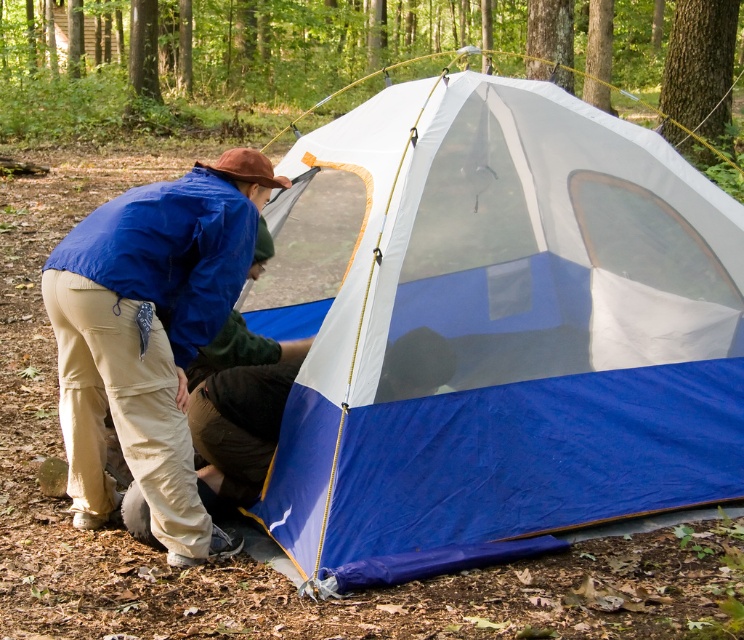
Question: Does blue tarpaulin tent at center have a larger size compared to blue fabric jacket at lower left?

Choices:
 (A) no
 (B) yes

Answer: (B)

Question: Does blue tarpaulin tent at center appear over blue fabric jacket at lower left?

Choices:
 (A) no
 (B) yes

Answer: (B)

Question: Which point appears farthest from the camera in this image?

Choices:
 (A) (164, 314)
 (B) (372, 419)

Answer: (B)

Question: Does blue tarpaulin tent at center appear on the left side of blue fabric jacket at lower left?

Choices:
 (A) yes
 (B) no

Answer: (B)